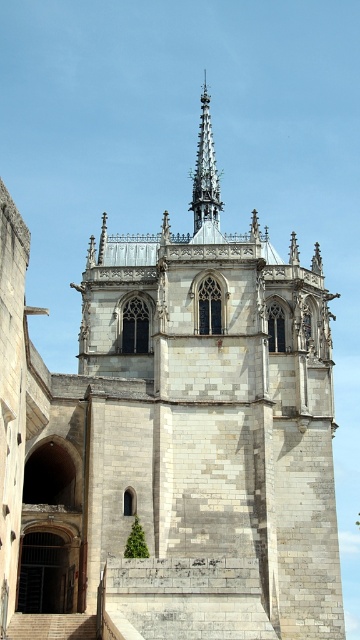
Is point (209, 212) closer to camera compared to point (38, 618)?

That is False.

Does gray stone spire at upper center appear under smooth stone stairs at lower left?

Incorrect, gray stone spire at upper center is not positioned below smooth stone stairs at lower left.

What are the coordinates of `gray stone spire at upper center` in the screenshot? It's located at (204, 170).